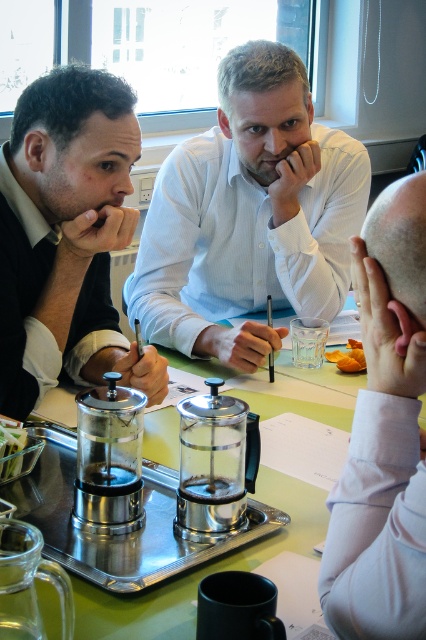
You are a server at a banquet and you need to place a 16 inch long cake on the clear glass tray at center. Can you fit the cake on the white textured shirt at center without overlapping?

The white textured shirt at center is only 15.92 inches from the clear glass tray at center, which means the distance between them is insufficient to accommodate a 16 inch cake. The cake would overlap both objects.

Based on the coordinates provided, which object is located at point (66,236)?

The point (66,236) corresponds to the matte black shirt at left.